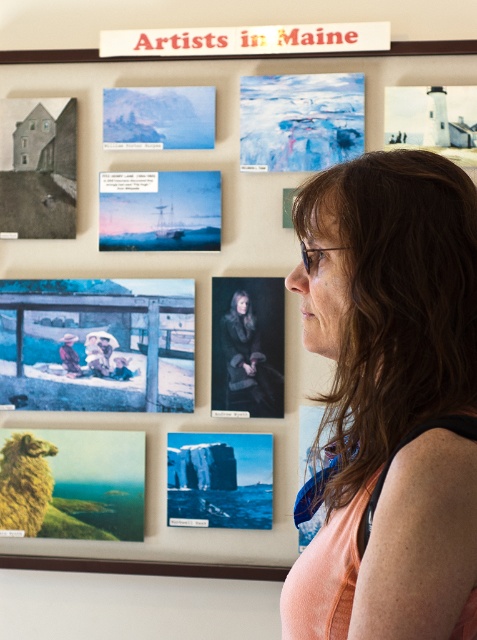
Who is taller, blue faded photo at lower left or blue matte painting at center?

blue faded photo at lower left

Does blue faded photo at lower left have a greater width compared to blue matte painting at center?

Yes, blue faded photo at lower left is wider than blue matte painting at center.

Is point (154, 326) less distant than point (152, 225)?

Yes, it is.

The height and width of the screenshot is (640, 477). Find the location of `blue faded photo at lower left`. blue faded photo at lower left is located at coordinates (97, 344).

From the picture: Between blue matte rock formation at center and blue matte painting at center, which one is positioned lower?

blue matte rock formation at center

Is blue matte rock formation at center positioned in front of blue matte painting at center?

Yes, it is in front of blue matte painting at center.

Is point (252, 486) more distant than point (207, 182)?

That is False.

Identify the location of blue matte rock formation at center. Image resolution: width=477 pixels, height=640 pixels. (219, 480).

Describe the element at coordinates (72, 483) in the screenshot. The image size is (477, 640). I see `fluffy wool sheep at lower left` at that location.

Is fluffy wool sheep at lower left wider than matte paper house at left?

Indeed, fluffy wool sheep at lower left has a greater width compared to matte paper house at left.

The image size is (477, 640). Find the location of `fluffy wool sheep at lower left`. fluffy wool sheep at lower left is located at coordinates [72, 483].